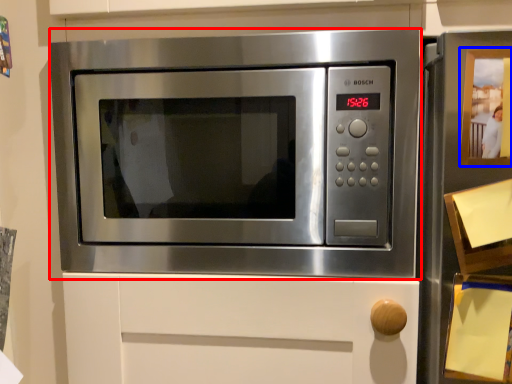
Question: Which object is closer to the camera taking this photo, microwave oven (highlighted by a red box) or button (highlighted by a blue box)?

Choices:
 (A) microwave oven
 (B) button

Answer: (B)